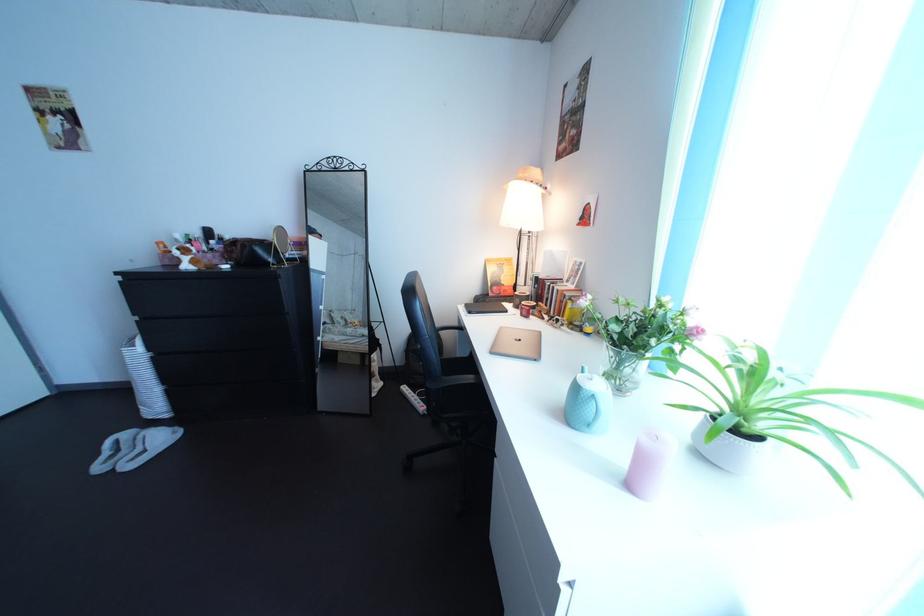
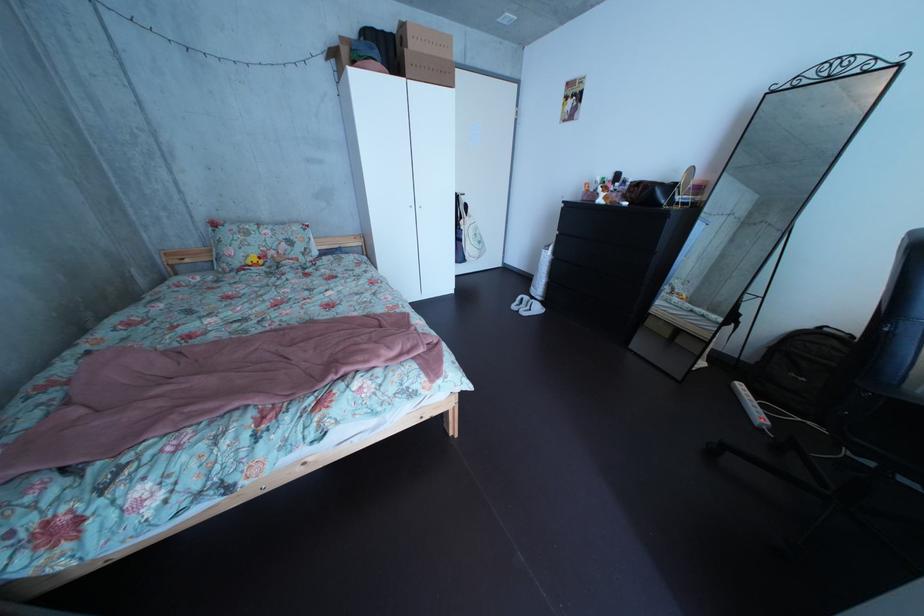
Locate, in the second image, the point that corresponds to point 140,443 in the first image.

(541, 306)